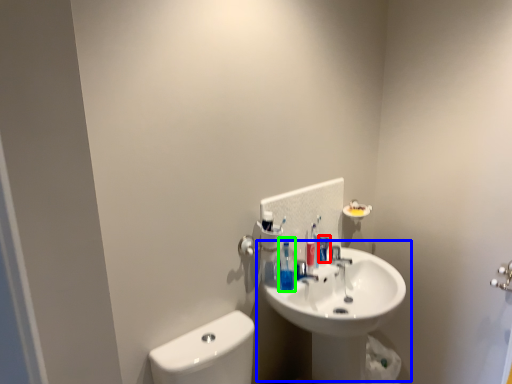
Question: Which is nearer to the mouthwash (highlighted by a red box)? sink (highlighted by a blue box) or toiletry (highlighted by a green box).

Choices:
 (A) sink
 (B) toiletry

Answer: (B)